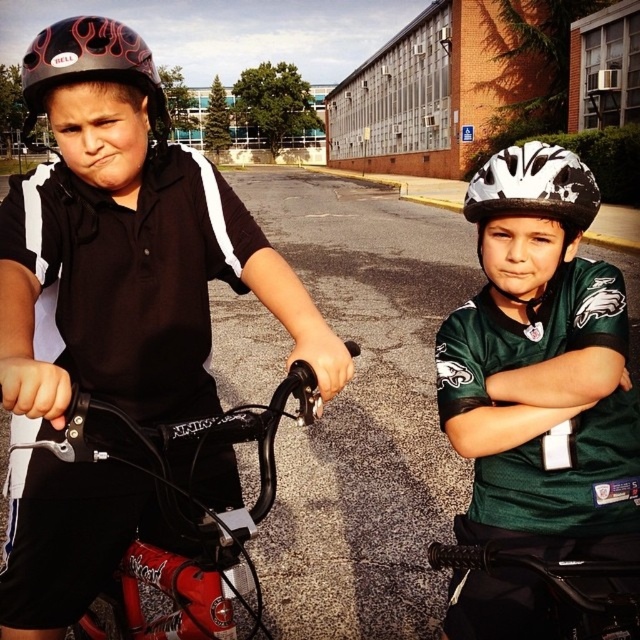
You are a delivery person who needs to place a small package between the white matte helmet at center and the black matte handlebar at center. Can you fit the package there?

The white matte helmet at center is above the black matte handlebar at center, so there is vertical space between them. However, the horizontal distance may be too narrow for the package unless it is very small.

You are a delivery drone operator. Your drone needs to fly between the white matte helmet at center and the black matte handlebar at center to deliver a package. What is the minimum vertical clearance needed for the drone to pass safely?

The minimum vertical clearance needed for the drone to pass safely between the white matte helmet at center and the black matte handlebar at center is 26.59 inches, as that is the distance between them.

Consider the image. You are a photographer trying to capture a clear shot of both the white matte helmet at center and the black matte handlebar at center in the image. Since you want to ensure both are visible, which object should you focus on first to account for their size?

The white matte helmet at center is bigger than the black matte handlebar at center, so you should focus on the white matte helmet at center first to ensure its details are sharp before adjusting for the smaller handlebar.